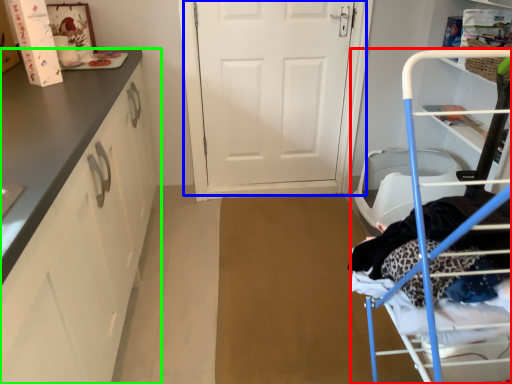
Question: Estimate the real-world distances between objects in this image. Which object is closer to furniture (highlighted by a red box), door (highlighted by a blue box) or cabinetry (highlighted by a green box)?

Choices:
 (A) door
 (B) cabinetry

Answer: (B)